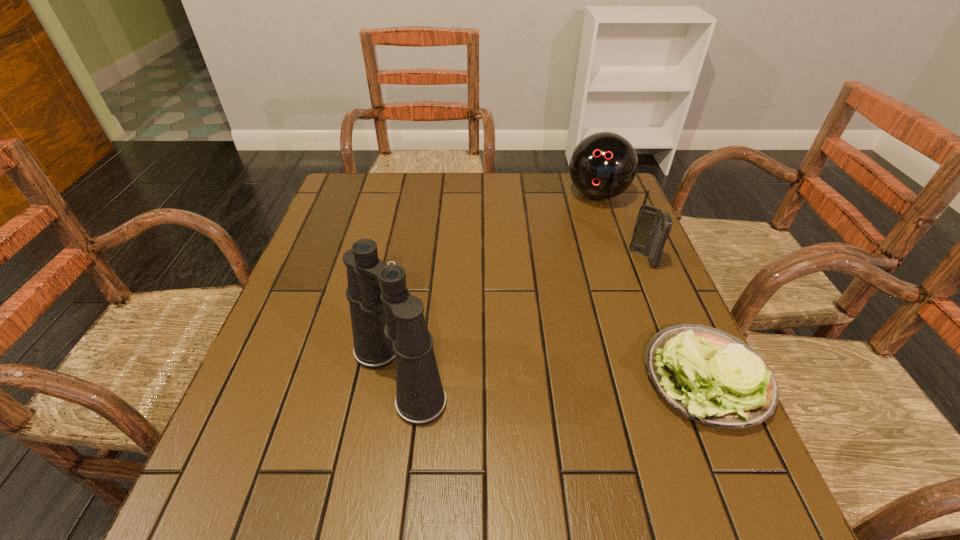
At what (x,y) coordinates should I click in order to perform the action: click on vacant space on the desktop that is between the tallest object and the shortest object and is positioned on the keyboard of the second farthest object. Please return your answer as a coordinate pair (x, y). The height and width of the screenshot is (540, 960). Looking at the image, I should click on (577, 377).

Identify the location of free space on the desktop that is between the leftmost object and the shortest object and is positioned on the surface of the bowling ball near the finger holes. This screenshot has width=960, height=540. (523, 377).